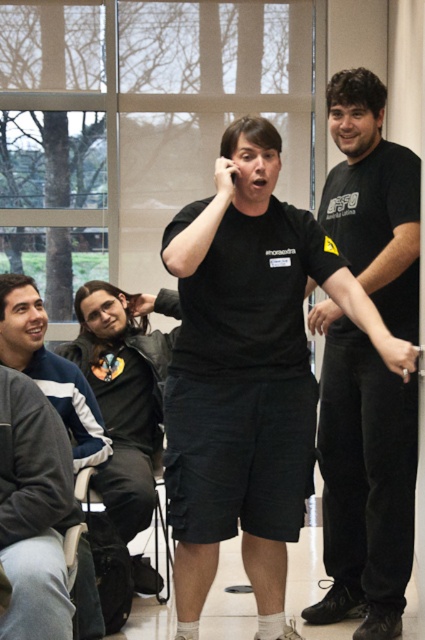
Question: Considering the real-world distances, which object is closest to the black matte shirt at right?

Choices:
 (A) matte black hand at upper left
 (B) gray fleece jacket at upper left
 (C) matte black hand at right

Answer: (C)

Question: Based on their relative distances, which object is nearer to the black matte shorts at center?

Choices:
 (A) black matte shirt at right
 (B) matte black hand at center
 (C) gray fleece jacket at upper left
 (D) matte black hand at right

Answer: (A)

Question: Is gray fleece jacket at upper left bigger than matte black hand at center?

Choices:
 (A) yes
 (B) no

Answer: (A)

Question: Can you confirm if black matte shorts at center is positioned above black matte shirt at right?

Choices:
 (A) yes
 (B) no

Answer: (B)

Question: Does gray fleece jacket at upper left have a larger size compared to matte black hand at upper left?

Choices:
 (A) no
 (B) yes

Answer: (B)

Question: Which point is farther to the camera?

Choices:
 (A) matte black hand at right
 (B) black matte shorts at center

Answer: (B)